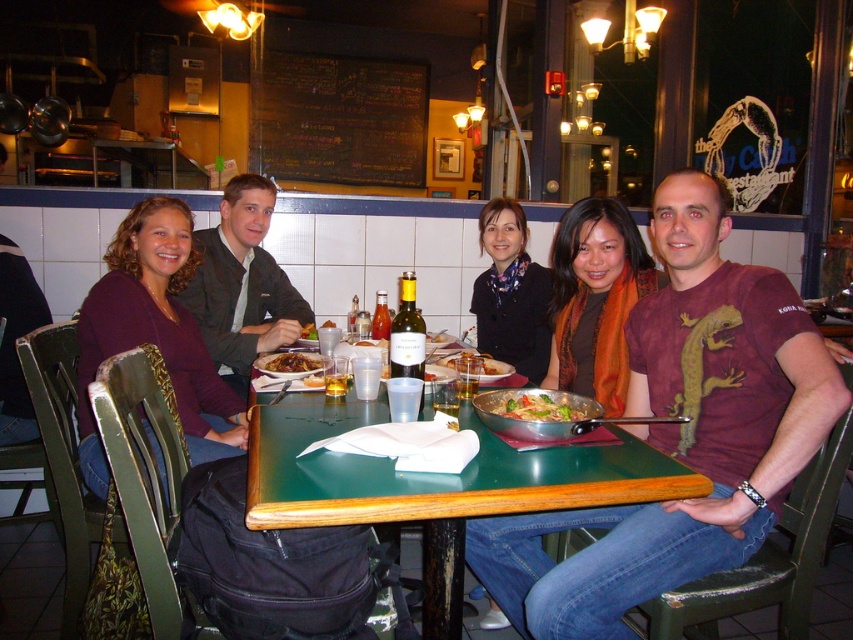
Question: Is maroon t-shirt at center to the left of orange scarf at center from the viewer's perspective?

Choices:
 (A) no
 (B) yes

Answer: (A)

Question: Which of these objects is positioned farthest from the metallic silver pan at center?

Choices:
 (A) green glossy table at center
 (B) black chalkboard at upper center
 (C) maroon t-shirt at center

Answer: (B)

Question: From the image, what is the correct spatial relationship of metallic silver pan at center in relation to translucent glass bottle at table center?

Choices:
 (A) left
 (B) right

Answer: (B)

Question: Which object appears closest to the camera in this image?

Choices:
 (A) black chalkboard at upper center
 (B) yellowish matte bowl at center
 (C) metallic silver pan at center

Answer: (C)

Question: Can you confirm if black chalkboard at upper center is wider than dark blue scarf at center?

Choices:
 (A) yes
 (B) no

Answer: (A)

Question: Which of the following is the farthest from the observer?

Choices:
 (A) click(x=805, y=442)
 (B) click(x=502, y=372)
 (C) click(x=83, y=474)
 (D) click(x=523, y=240)

Answer: (D)